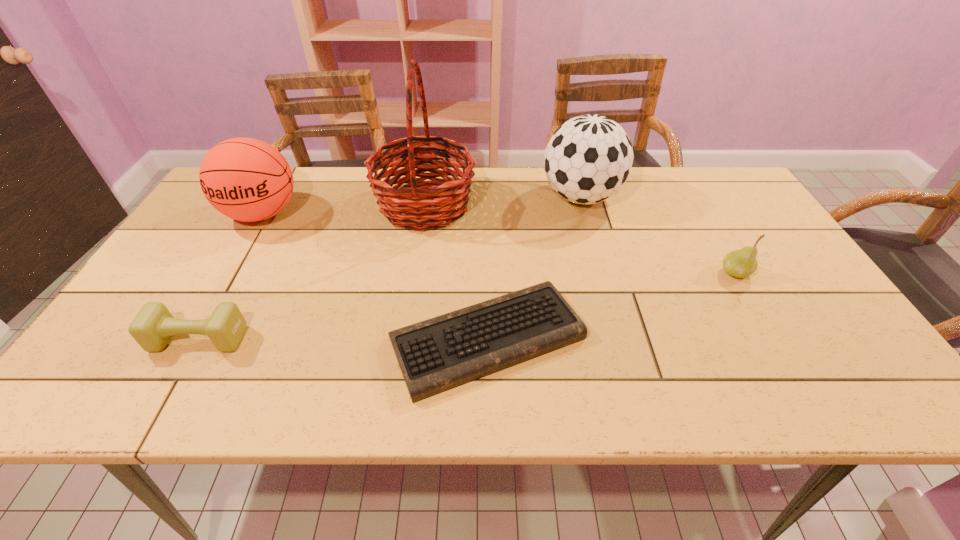
Find the location of a particular element. The image size is (960, 540). object that is at the far left corner is located at coordinates (246, 179).

I want to click on vacant space at the far edge, so click(312, 174).

Where is `free space at the near edge`? This screenshot has height=540, width=960. free space at the near edge is located at coordinates (320, 377).

This screenshot has height=540, width=960. Identify the location of vacant space at the left edge of the desktop. (178, 259).

Locate an element on the screen. This screenshot has width=960, height=540. vacant space at the far right corner of the desktop is located at coordinates (682, 177).

The width and height of the screenshot is (960, 540). Find the location of `free space between the shortest object and the tallest object`. free space between the shortest object and the tallest object is located at coordinates (456, 272).

Image resolution: width=960 pixels, height=540 pixels. Find the location of `free space between the dumbbell and the soccer ball`. free space between the dumbbell and the soccer ball is located at coordinates (390, 268).

Locate an element on the screen. vacant point located between the third shortest object and the soccer ball is located at coordinates (658, 235).

The height and width of the screenshot is (540, 960). I want to click on free space between the tallest object and the shortest object, so click(456, 272).

Where is `free space that is in between the computer keyboard and the basket`? The width and height of the screenshot is (960, 540). free space that is in between the computer keyboard and the basket is located at coordinates (456, 272).